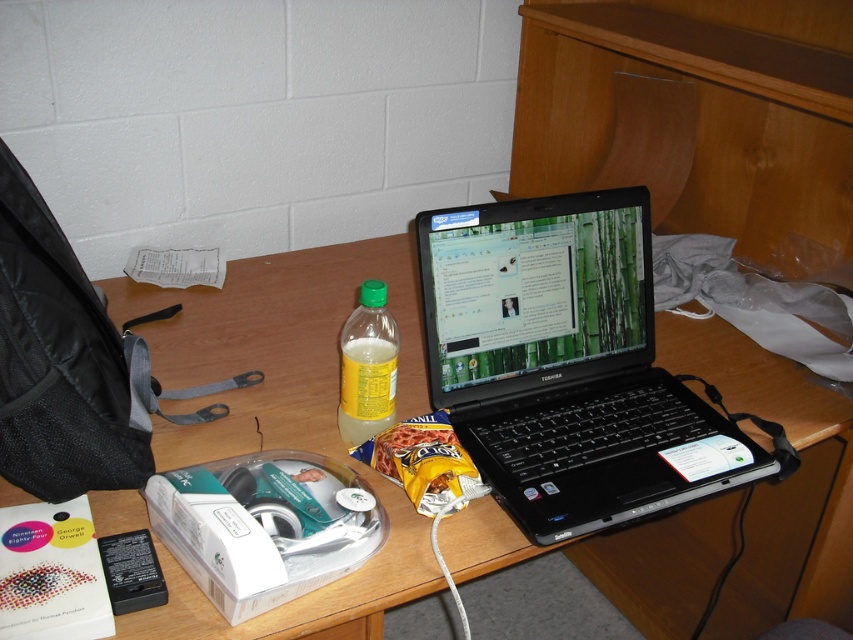
Question: Does black plastic laptop at center appear over translucent plastic bottle at center?

Choices:
 (A) yes
 (B) no

Answer: (A)

Question: Estimate the real-world distances between objects in this image. Which object is farther from the translucent plastic bottle at center?

Choices:
 (A) wooden at center
 (B) black plastic laptop at center

Answer: (B)

Question: Which object is the farthest from the wooden at center?

Choices:
 (A) translucent plastic bottle at center
 (B) black plastic laptop at center

Answer: (B)

Question: Does black plastic laptop at center appear under translucent plastic bottle at center?

Choices:
 (A) yes
 (B) no

Answer: (B)

Question: Can you confirm if black plastic laptop at center is wider than translucent plastic bottle at center?

Choices:
 (A) no
 (B) yes

Answer: (B)

Question: Estimate the real-world distances between objects in this image. Which object is farther from the wooden at center?

Choices:
 (A) black plastic laptop at center
 (B) translucent plastic bottle at center

Answer: (A)